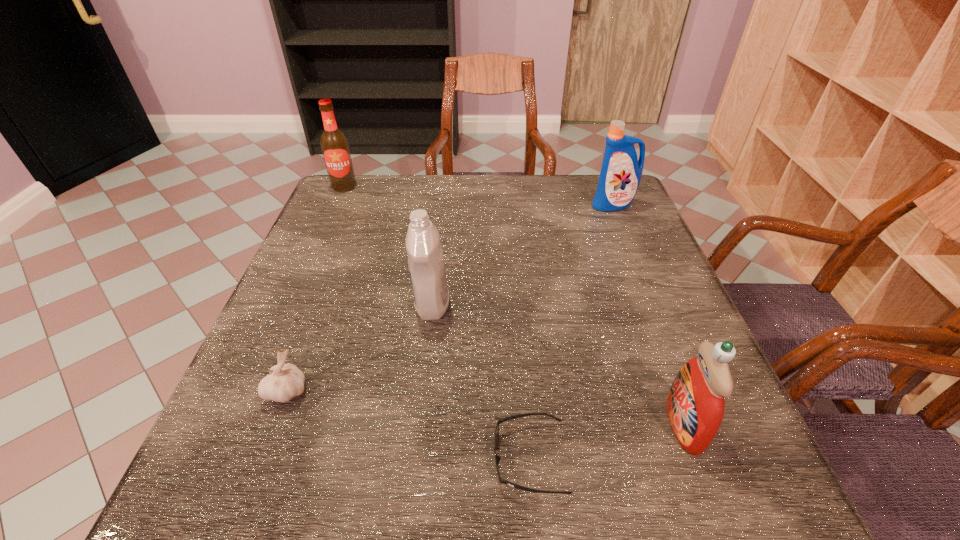
You are a GUI agent. You are given a task and a screenshot of the screen. Output one action in this format:
    pyautogui.click(x=<x>, y=<y>)
    Task: Click on the vacant region between the farthest object and the nearest detergent
    
    Given the screenshot: What is the action you would take?
    (514, 306)

This screenshot has width=960, height=540. In order to click on vacant area between the fourth object from left to right and the beer bottle in this screenshot , I will do `click(437, 322)`.

Identify the location of free point between the beer bottle and the garlic. The image size is (960, 540). (316, 289).

Point out which object is positioned as the fifth nearest to the fourth object from left to right. Please provide its 2D coordinates. Your answer should be formatted as a tuple, i.e. [(x, y)], where the tuple contains the x and y coordinates of a point satisfying the conditions above.

[(335, 148)]

Locate an element on the screen. object that is the fourth closest to the second shortest object is located at coordinates (335, 148).

Locate an element on the screen. detergent that stands as the second closest to the fifth tallest object is located at coordinates (695, 404).

I want to click on detergent that can be found as the second closest to the garlic, so click(x=695, y=404).

The image size is (960, 540). I want to click on free region that satisfies the following two spatial constraints: 1. on the label of the farthest detergent; 2. on the front-facing side of the sunglasses, so click(716, 458).

At what (x,y) coordinates should I click in order to perform the action: click on free point that satisfies the following two spatial constraints: 1. on the label of the second farthest object; 2. on the front surface of the nearest detergent. Please return your answer as a coordinate pair (x, y). Looking at the image, I should click on (703, 424).